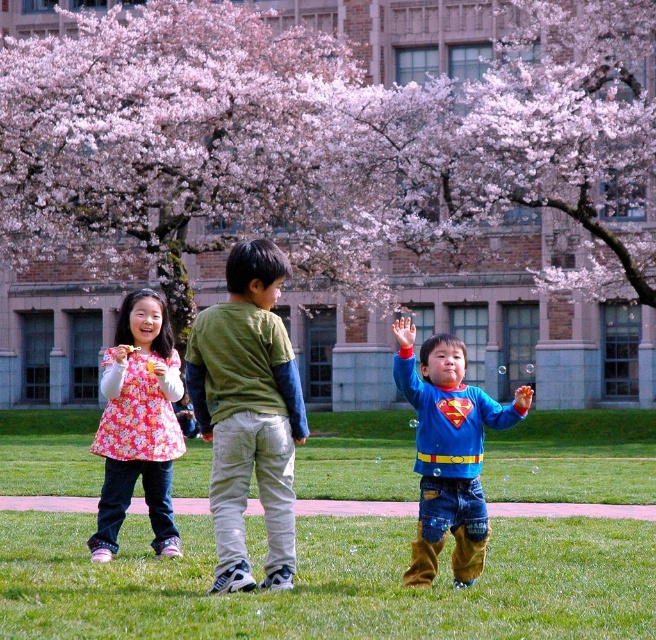
You are a photographer trying to capture a photo of the blue cotton shirt at center and the green grass at center. Which object is positioned to the right of the other?

The green grass at center is to the right of the blue cotton shirt at center.

Consider the image. You are a photographer trying to capture a group photo of the green cotton shirt at center and the blue cotton shirt at center. Since you want both shirts to appear the same size in the photo, which child should you move closer to the camera?

The green cotton shirt at center is smaller than the blue cotton shirt at center, so you should move the child wearing the green cotton shirt at center closer to the camera to make them appear the same size in the photo.